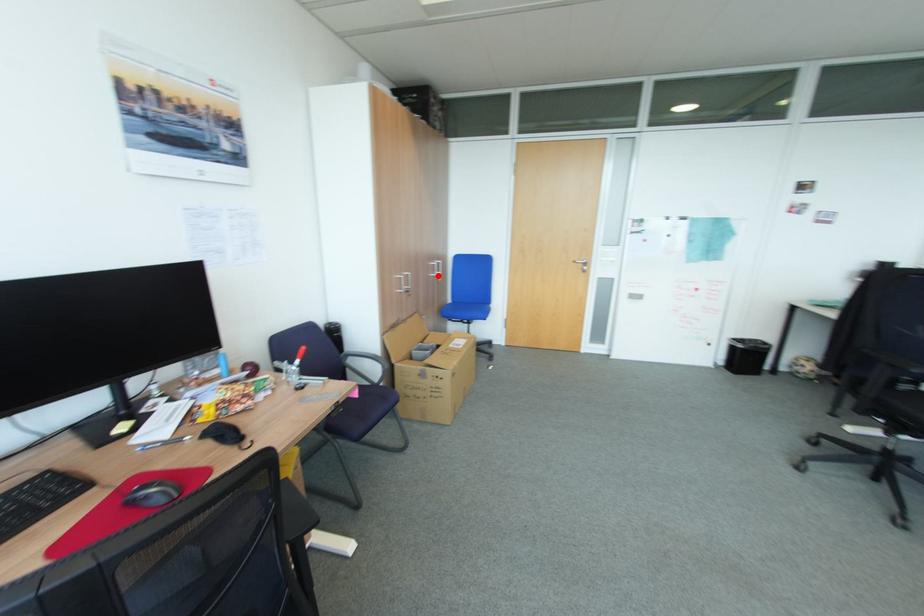
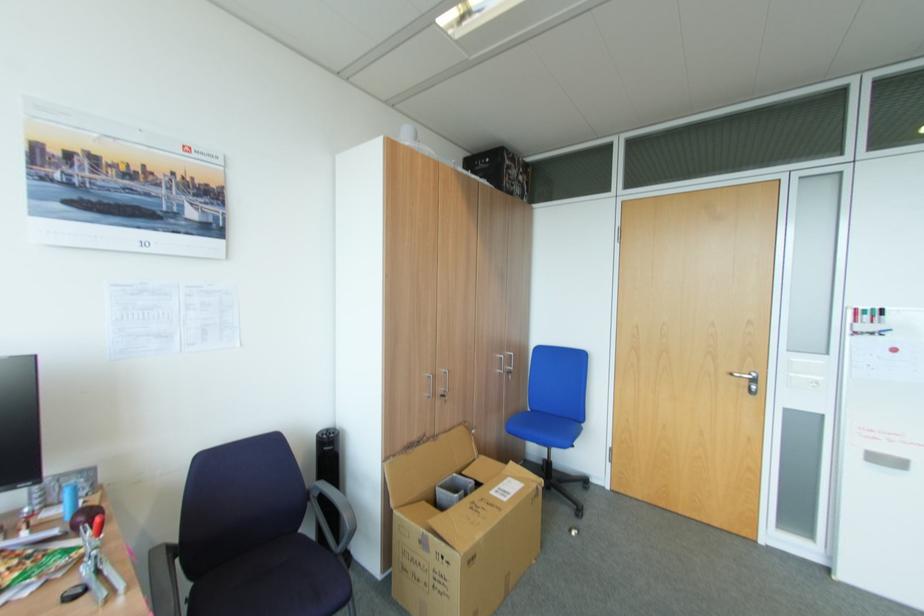
Locate, in the second image, the point that corresponds to the highlighted location in the first image.

(505, 371)